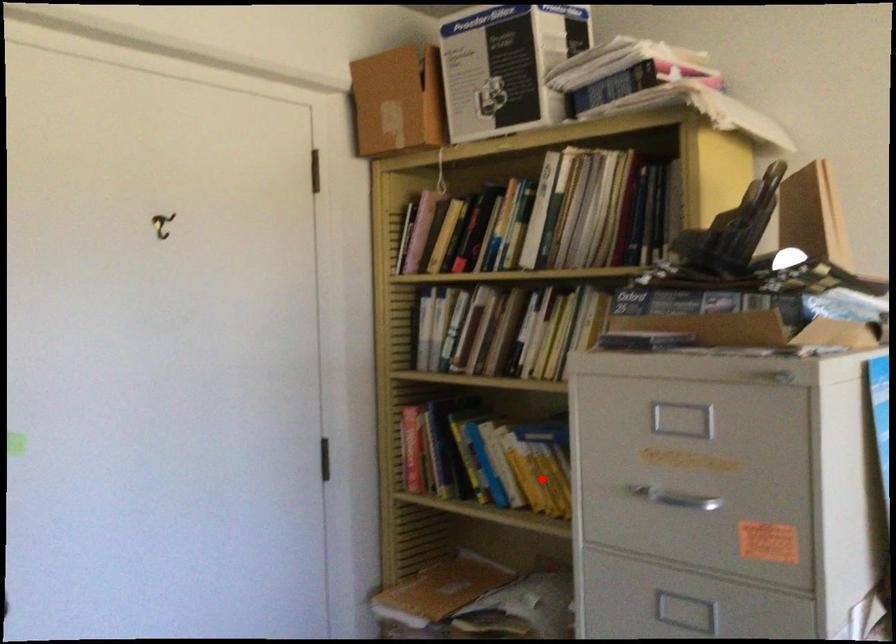
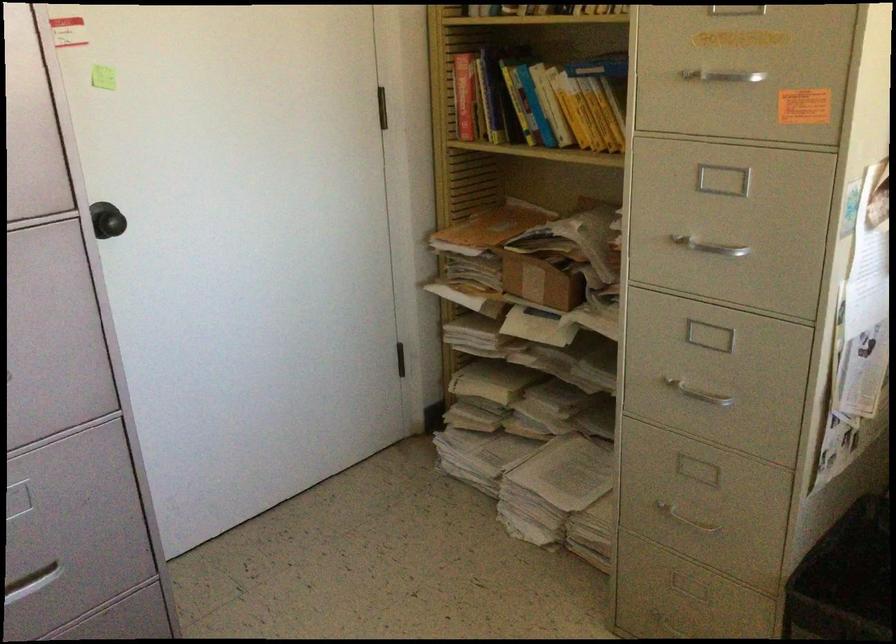
The point at the highlighted location is marked in the first image. Where is the corresponding point in the second image?

(590, 114)